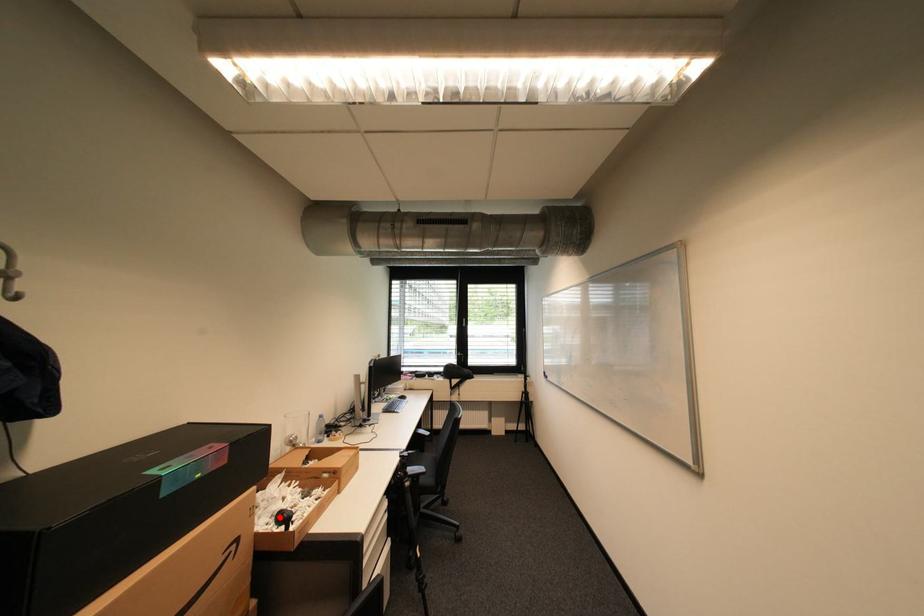
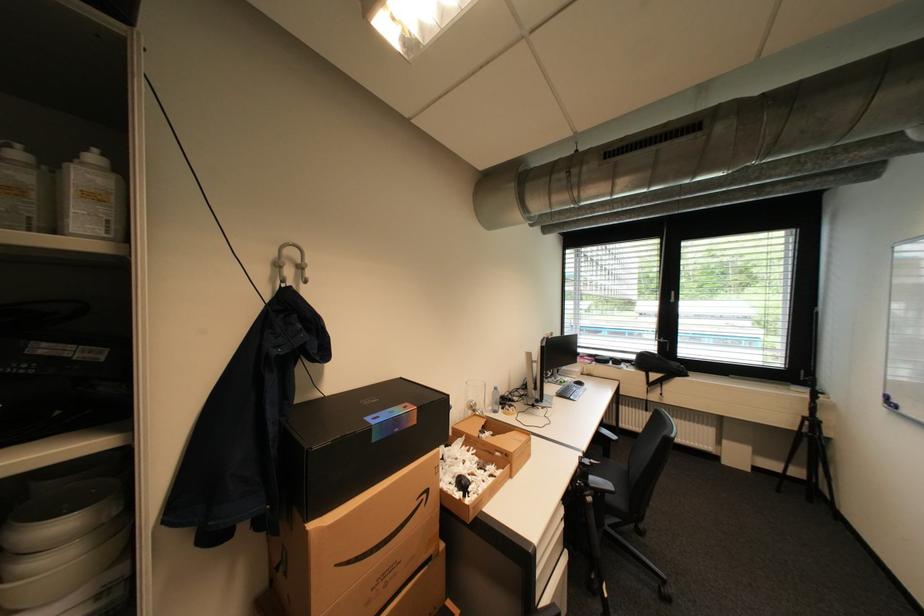
Locate, in the second image, the point that corresponds to the highlighted location in the first image.

(462, 477)